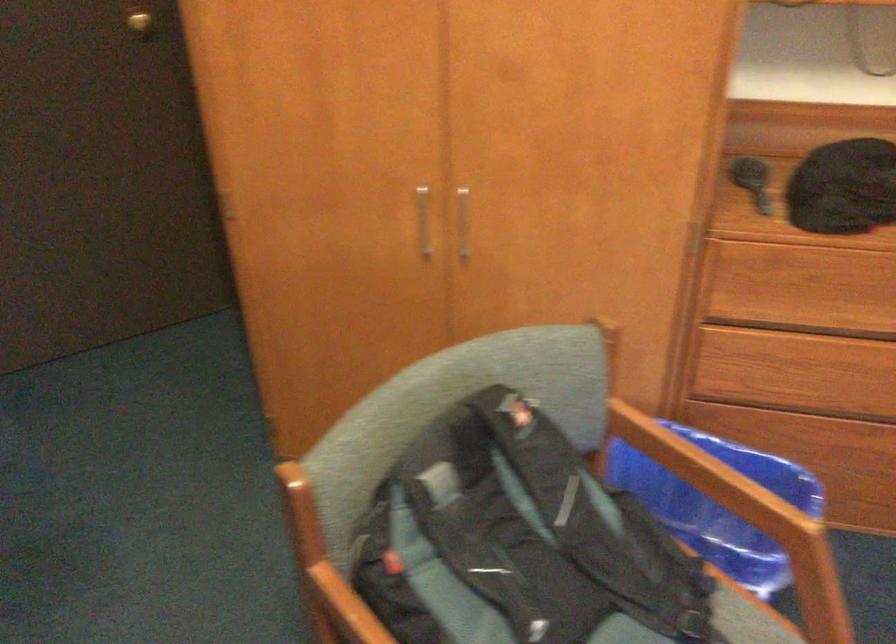
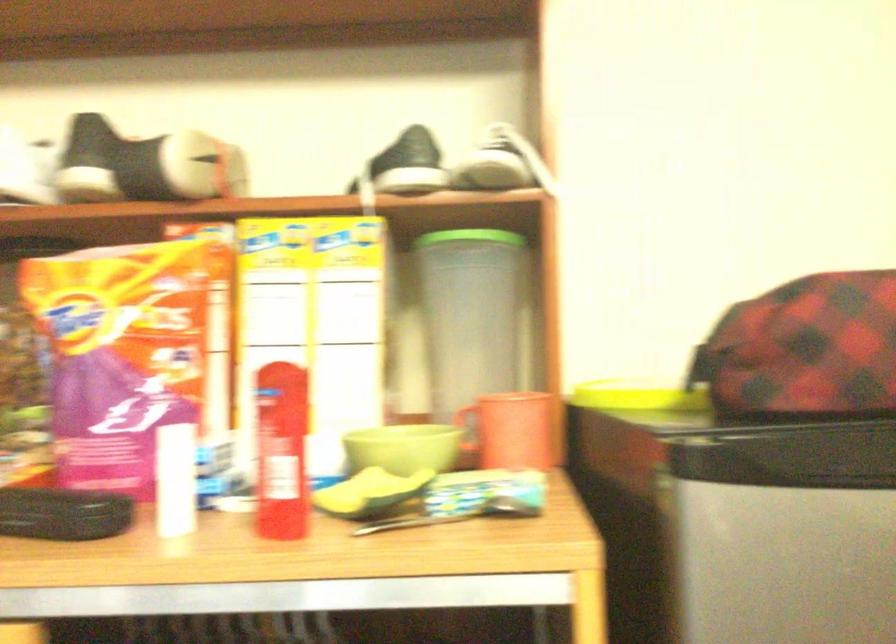
Question: How did the camera likely rotate?

Choices:
 (A) Left
 (B) Right
 (C) Up
 (D) Down

Answer: (A)